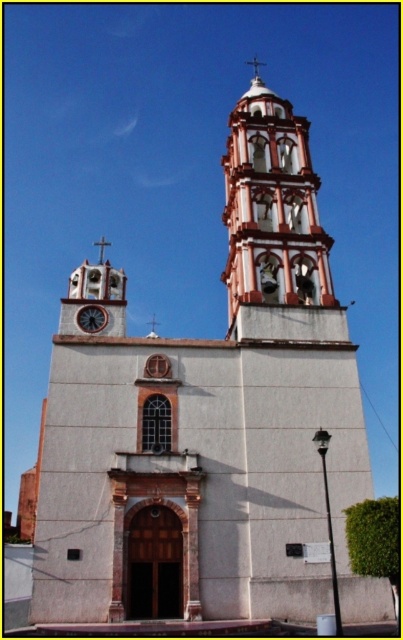
You are standing in front of the church and notice two structures at the top. The white painted brick tower at upper center and the white stucco spire at upper center. Which one is positioned to the left?

The white painted brick tower at upper center is to the left of the white stucco spire at upper center.

You are standing in front of the church and want to know which object is taller between the wooden clock at center and the white stucco spire at upper center. Based on the scene, can you determine which one is taller?

The white stucco spire at upper center is taller than the wooden clock at center.

You are standing in front of the church and want to take a photo that includes both the white painted brick tower at upper center and the wooden clock at center. Which object should you focus on first to ensure both are in frame?

You should focus on the white painted brick tower at upper center first because it is larger and will require more space in the frame, ensuring the smaller wooden clock at center is also captured.